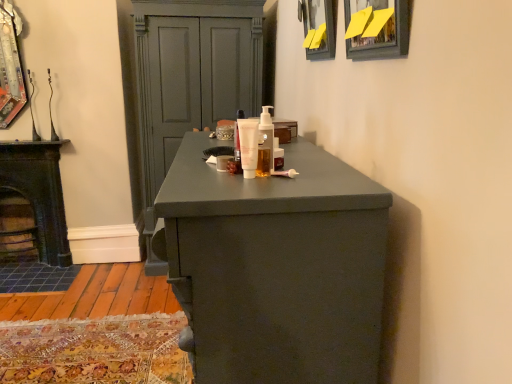
Locate an element on the screen. vacant area located to the right-hand side of white matte tube at center is located at coordinates (302, 160).